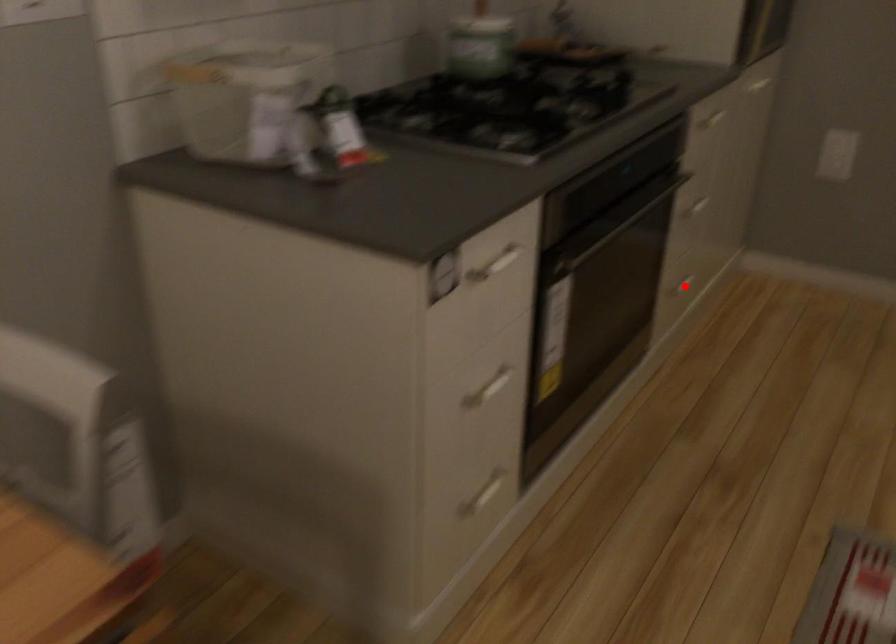
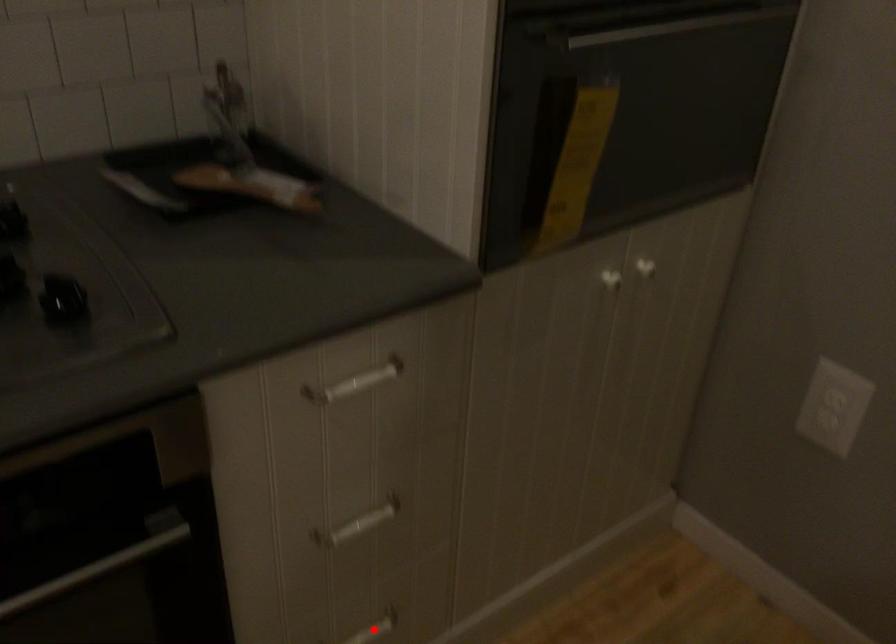
I am providing you with two images of the same scene from different viewpoints. A red point is marked on the first image and another point is marked on the second image. Are the points marked in image1 and image2 representing the same 3D position?

Yes